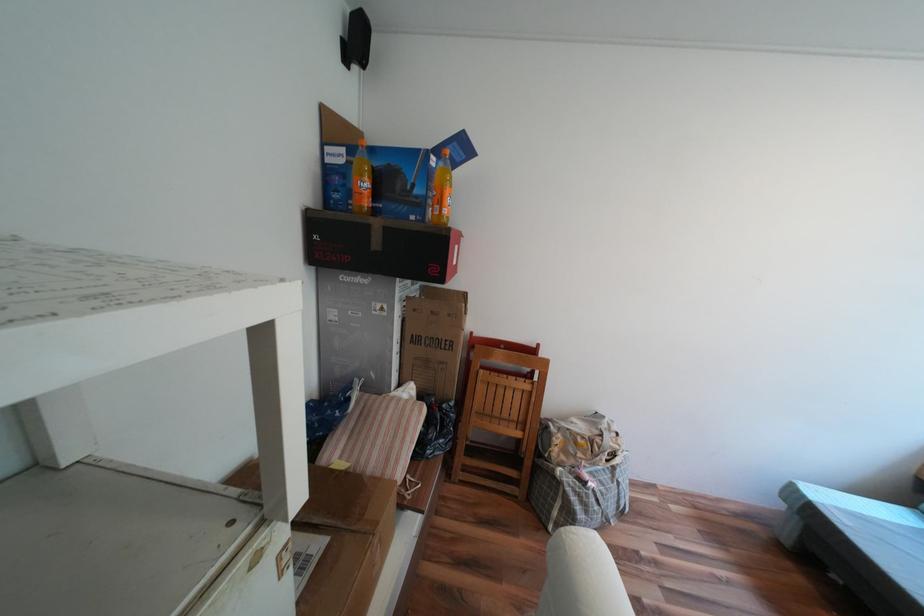
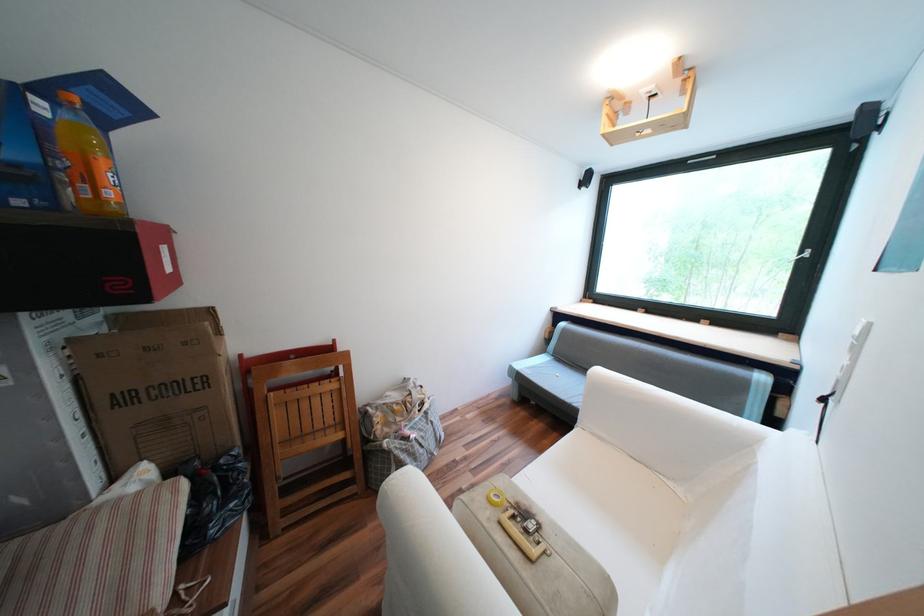
The point at (455, 211) is marked in the first image. Where is the corresponding point in the second image?

(118, 193)